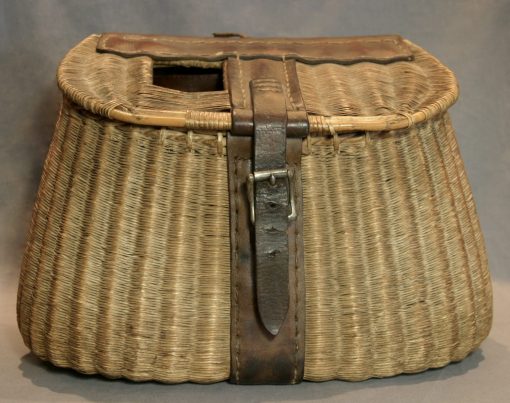
What are the coordinates of `wall of basket` in the screenshot? It's located at (168, 282).